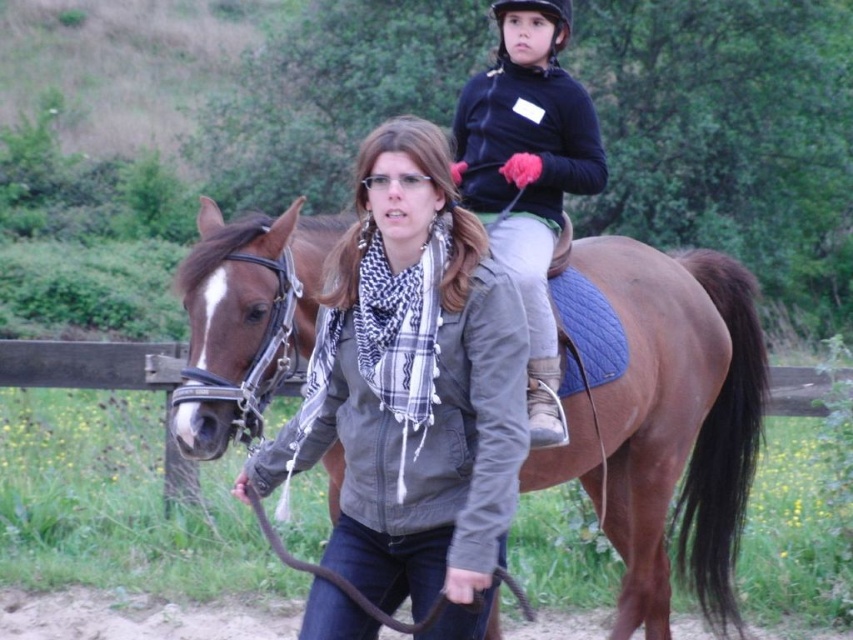
Question: Which object is closer to the camera taking this photo?

Choices:
 (A) black matte helmet at upper center
 (B) matte gray jacket at center
 (C) dark blue jersey at upper center
 (D) brown leather saddle at center

Answer: (B)

Question: Estimate the real-world distances between objects in this image. Which object is farther from the black matte helmet at upper center?

Choices:
 (A) matte gray jacket at center
 (B) dark blue jersey at upper center

Answer: (A)

Question: Does brown leather saddle at center have a greater width compared to matte gray jacket at center?

Choices:
 (A) no
 (B) yes

Answer: (B)

Question: Is dark blue jersey at upper center below black matte helmet at upper center?

Choices:
 (A) yes
 (B) no

Answer: (A)

Question: Can you confirm if dark blue jersey at upper center is positioned to the left of black matte helmet at upper center?

Choices:
 (A) no
 (B) yes

Answer: (B)

Question: Among these points, which one is farthest from the camera?

Choices:
 (A) tap(210, 228)
 (B) tap(570, 26)
 (C) tap(386, 561)
 (D) tap(468, 97)

Answer: (B)